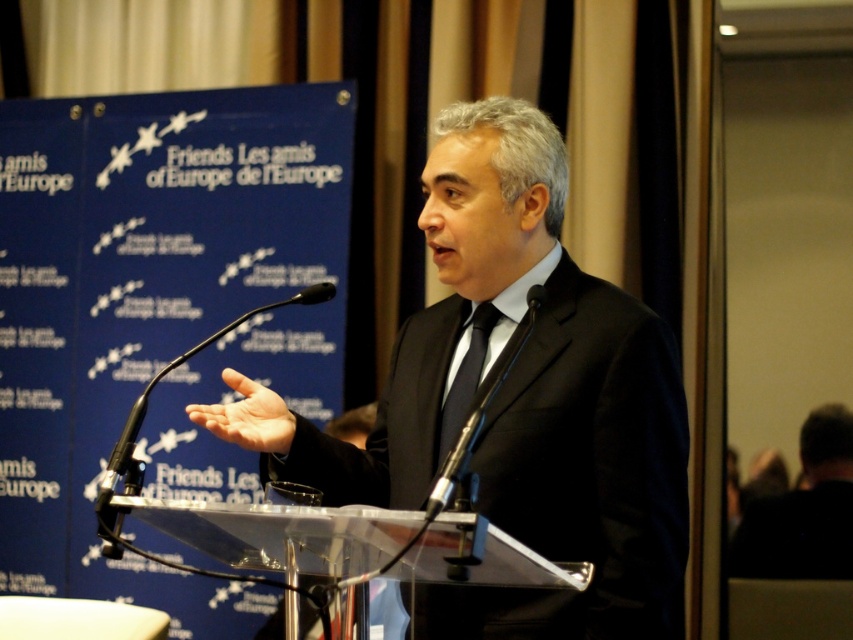
You are a photographer standing in the front row of the audience. You want to take a photo of the speaker while ensuring both the black suit at right and the black silk tie at center are clearly visible. Given that your camera has a minimum focus distance of 5 feet, will you be able to capture both objects in focus without moving closer?

The black suit at right is 5.58 feet from the black silk tie at center. Since the distance between them is greater than the camera minimum focus distance of 5 feet, the camera can capture both objects in focus without moving closer.

You are a photographer positioned in front of the podium where the man in the black suit at right is speaking. You want to capture a closeup shot of his face without including the podium. Considering your current position, is it possible to do so without moving closer than 3 meters?

The distance between the black suit at right and the viewer is 3.42 meters, so yes, you can capture a closeup shot of his face without moving closer than 3 meters since you are already 3.42 meters away.

You are an event organizer who needs to ensure all participants can see the speaker clearly. The black suit at right and the black silk tie at center are both in the speaker s line of sight. Which object is wider and might block more of the speaker s view?

The black suit at right might be wider than the black silk tie at center, so it could potentially block more of the speaker s view.